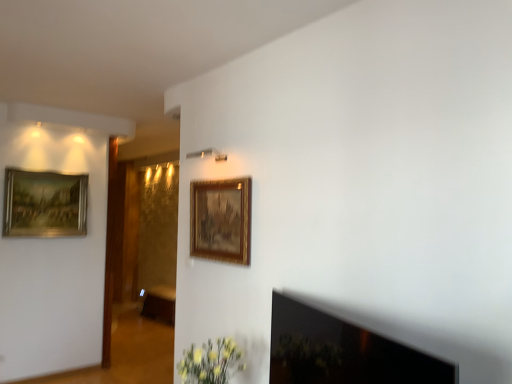
Question: Should I look upward or downward to see gold/gilded picture frame at upper center, which appears as the first picture frame when viewed from the right?

Choices:
 (A) up
 (B) down

Answer: (B)

Question: Could gold-framed painting at upper left, which ranks as the first picture frame in back-to-front order, be considered to be inside gold/gilded picture frame at upper center, the 2th picture frame from the back?

Choices:
 (A) no
 (B) yes

Answer: (A)

Question: From a real-world perspective, is gold/gilded picture frame at upper center, placed as the first picture frame when sorted from front to back, over gold-framed painting at upper left, the 2th picture frame viewed from the right?

Choices:
 (A) yes
 (B) no

Answer: (B)

Question: From the image's perspective, is gold/gilded picture frame at upper center, which appears as the first picture frame when viewed from the right, on top of gold-framed painting at upper left, the 2th picture frame viewed from the right?

Choices:
 (A) no
 (B) yes

Answer: (A)

Question: Does gold/gilded picture frame at upper center, the second picture frame in the left-to-right sequence, have a lesser height compared to gold-framed painting at upper left, which ranks as the first picture frame in back-to-front order?

Choices:
 (A) yes
 (B) no

Answer: (A)

Question: Is gold/gilded picture frame at upper center, which appears as the first picture frame when viewed from the right, not within gold-framed painting at upper left, which is the 1th picture frame in left-to-right order?

Choices:
 (A) no
 (B) yes

Answer: (B)

Question: From a real-world perspective, does gold/gilded picture frame at upper center, the 2th picture frame from the back, sit lower than gold-framed painting at upper left, the 2th picture frame viewed from the right?

Choices:
 (A) yes
 (B) no

Answer: (A)

Question: Does gold/gilded picture frame at upper center, the second picture frame in the left-to-right sequence, have a smaller size compared to brown wood cabinet at center?

Choices:
 (A) no
 (B) yes

Answer: (B)

Question: Can you confirm if gold/gilded picture frame at upper center, which appears as the first picture frame when viewed from the right, is thinner than brown wood cabinet at center?

Choices:
 (A) no
 (B) yes

Answer: (B)

Question: Does gold/gilded picture frame at upper center, placed as the first picture frame when sorted from front to back, turn towards brown wood cabinet at center?

Choices:
 (A) no
 (B) yes

Answer: (A)

Question: Is gold/gilded picture frame at upper center, placed as the first picture frame when sorted from front to back, to the left of brown wood cabinet at center from the viewer's perspective?

Choices:
 (A) no
 (B) yes

Answer: (A)

Question: From the image's perspective, is gold/gilded picture frame at upper center, the second picture frame in the left-to-right sequence, under brown wood cabinet at center?

Choices:
 (A) yes
 (B) no

Answer: (B)

Question: Is the depth of gold/gilded picture frame at upper center, the second picture frame in the left-to-right sequence, less than that of brown wood cabinet at center?

Choices:
 (A) yes
 (B) no

Answer: (A)

Question: Is gold-framed painting at upper left, the 2th picture frame viewed from the right, turned away from brown wood cabinet at center?

Choices:
 (A) yes
 (B) no

Answer: (B)